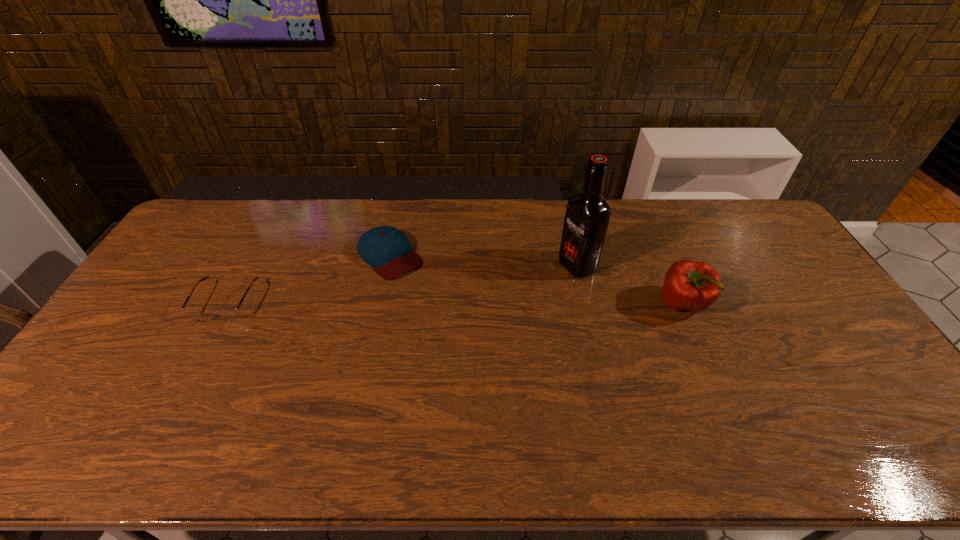
Where is `free space between the shortest object and the rightmost object`? free space between the shortest object and the rightmost object is located at coordinates (454, 302).

Locate an element on the screen. This screenshot has width=960, height=540. vacant space that is in between the leftmost object and the third shortest object is located at coordinates (454, 302).

At what (x,y) coordinates should I click in order to perform the action: click on the second closest object to the second shortest object. Please return your answer as a coordinate pair (x, y). Looking at the image, I should click on (587, 216).

Point out which object is positioned as the nearest to the second object from right to left. Please provide its 2D coordinates. Your answer should be formatted as a tuple, i.e. [(x, y)], where the tuple contains the x and y coordinates of a point satisfying the conditions above.

[(693, 286)]

What are the coordinates of `free region that satisfies the following two spatial constraints: 1. on the front-facing side of the shortest object; 2. on the right side of the bell pepper` in the screenshot? It's located at (225, 303).

Identify the location of free space in the image that satisfies the following two spatial constraints: 1. on the front side of the liquor; 2. on the left side of the bell pepper. (586, 303).